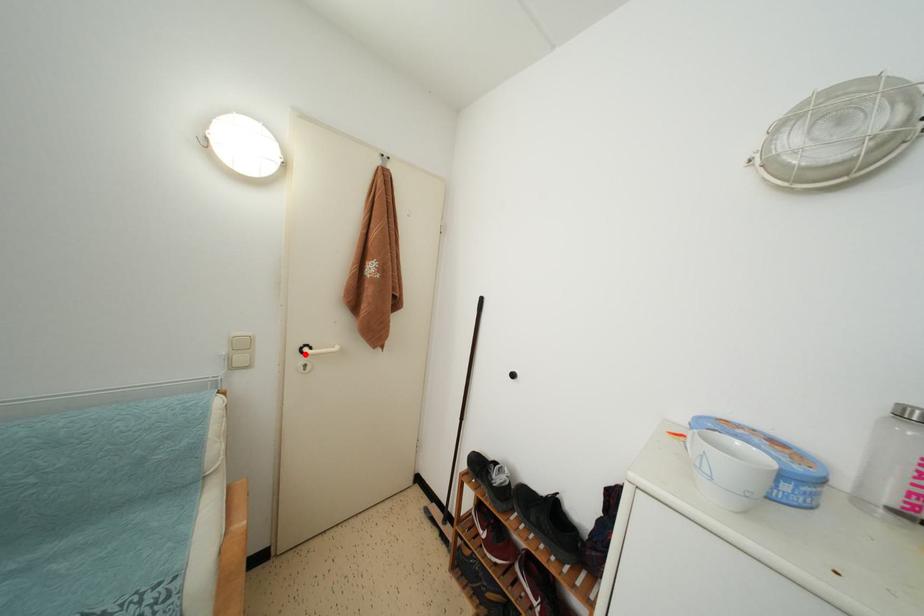
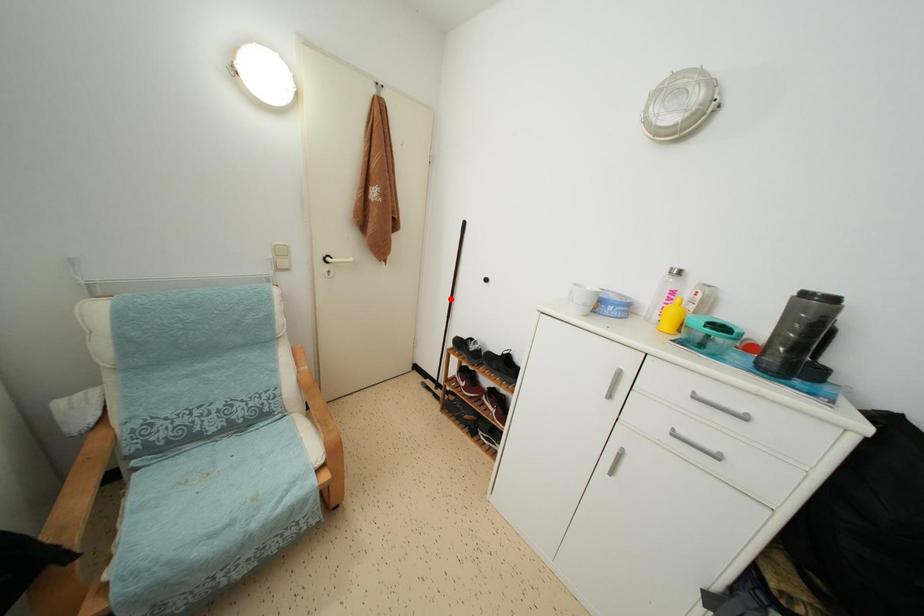
I am providing you with two images of the same scene from different viewpoints. A red point is marked on the first image and another point is marked on the second image. Do the highlighted points in image1 and image2 indicate the same real-world spot?

No